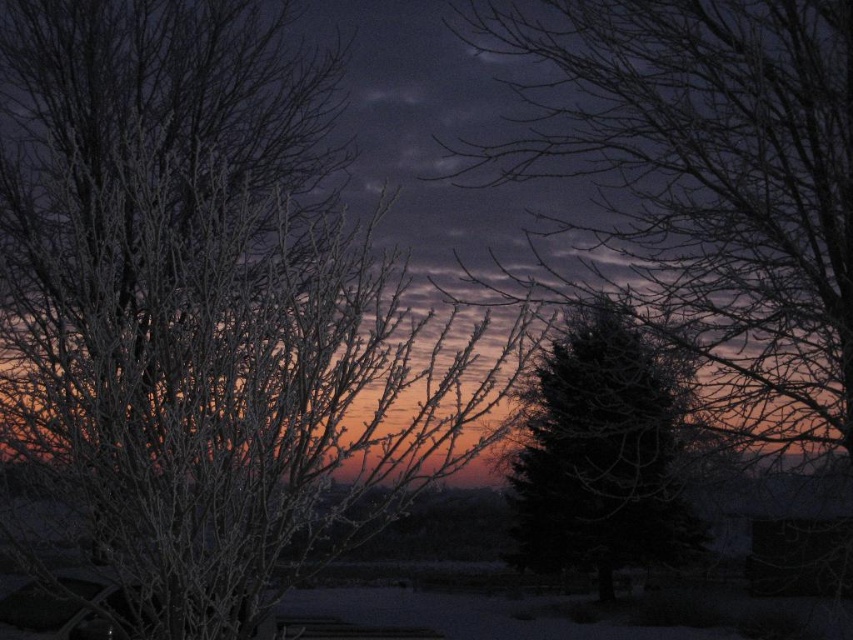
You are an artist trying to paint this winter scene. You want to ensure the frosted white branches at left and the frosted branches at center are proportionally accurate. Which of these two branches should you paint taller?

The frosted white branches at left should be painted taller than the frosted branches at center because the description states that the frosted white branches at left is taller than frosted branches at center.

You are an artist trying to paint the winter scene. You want to place the frosted white branches at left in your painting. According to the image, where should you position them relative to the center of the canvas?

The frosted white branches at left are located at point 0.473 on the horizontal axis and 0.236 on the vertical axis, which means they should be positioned slightly to the left and lower than the center of the canvas.